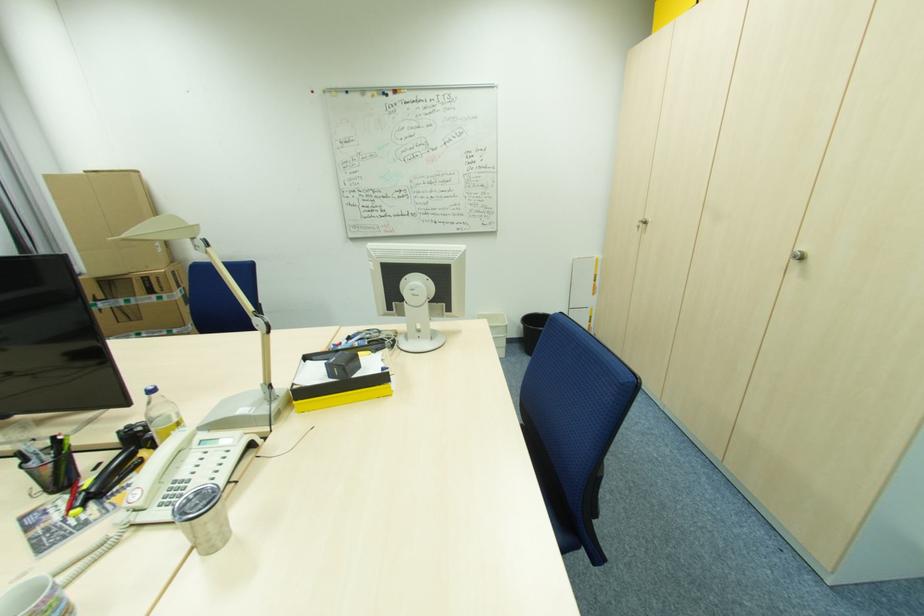
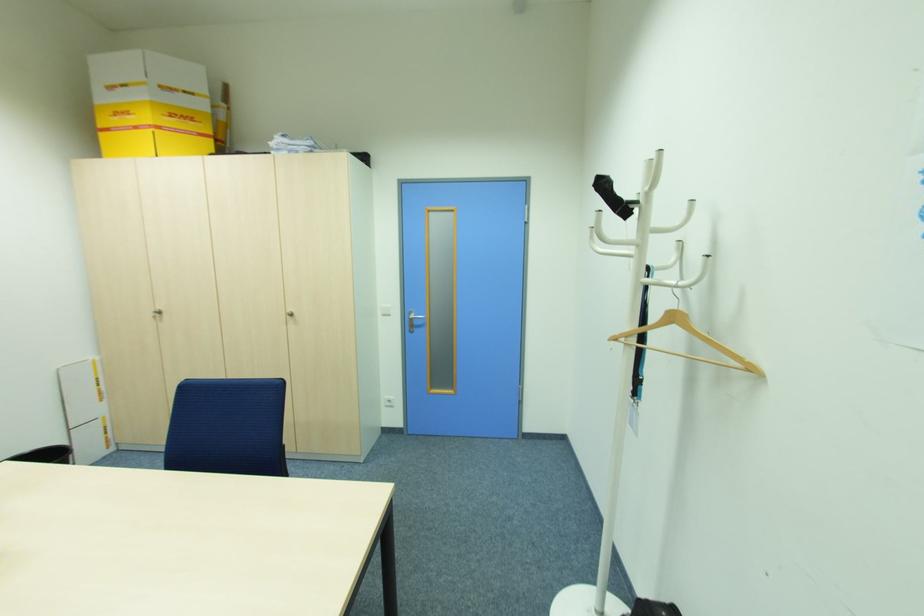
Find the pixel in the second image that matches point 806,248 in the first image.

(292, 310)